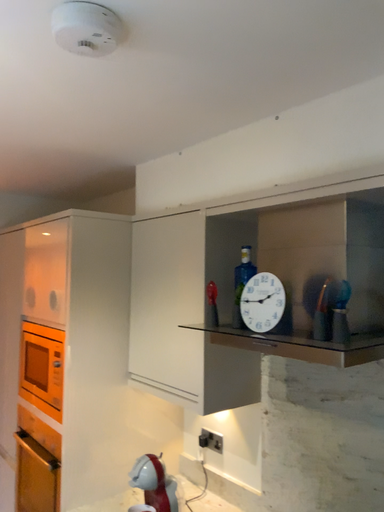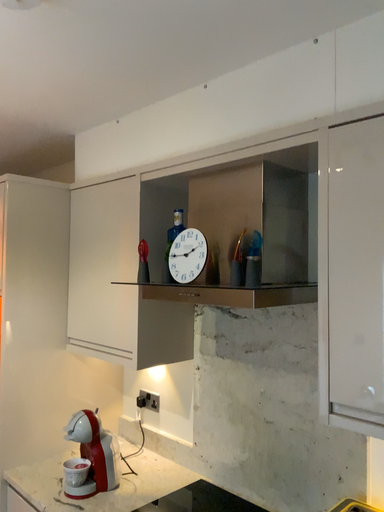
Question: Which way did the camera rotate in the video?

Choices:
 (A) rotated right
 (B) rotated left

Answer: (A)